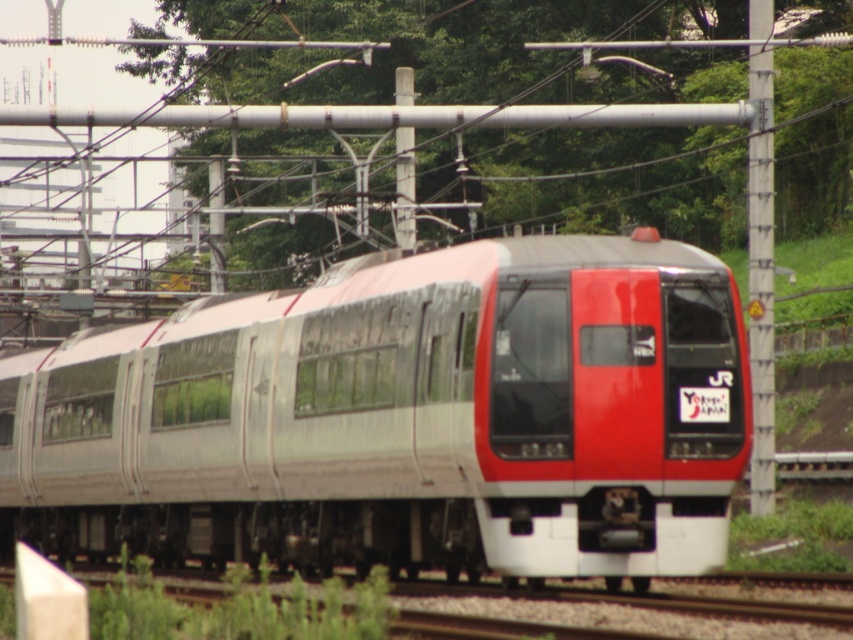
Question: Based on their relative distances, which object is farther from the metallic gray pole at center?

Choices:
 (A) silver metallic train at center
 (B) metallic gray pole at right

Answer: (B)

Question: Does silver metallic train at center have a larger size compared to metallic gray pole at right?

Choices:
 (A) yes
 (B) no

Answer: (A)

Question: Which of the following is the farthest from the observer?

Choices:
 (A) (563, 560)
 (B) (747, 220)

Answer: (B)

Question: Does silver metallic train at center come behind metallic gray pole at center?

Choices:
 (A) yes
 (B) no

Answer: (B)

Question: Which point is farther to the camera?

Choices:
 (A) (396, 195)
 (B) (535, 406)

Answer: (A)

Question: In this image, where is silver metallic train at center located relative to metallic gray pole at right?

Choices:
 (A) below
 (B) above

Answer: (A)